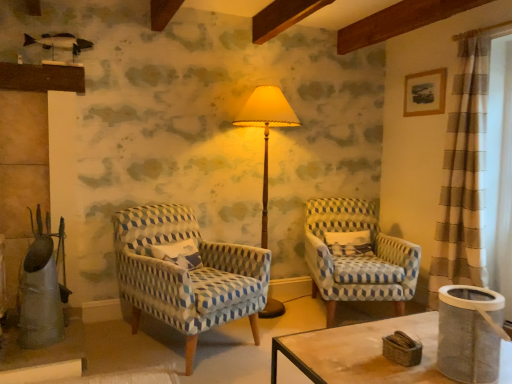
The image size is (512, 384). I want to click on vacant location below blue patterned fabric chair at center, marked as the 1th chair in a left-to-right arrangement (from a real-world perspective), so click(x=200, y=349).